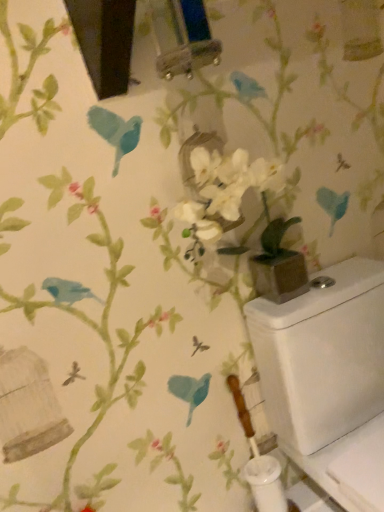
What is the approximate width of white glossy water tank at lower right?

It is 43.91 centimeters.

I want to click on white glossy water tank at lower right, so click(x=322, y=354).

Image resolution: width=384 pixels, height=512 pixels. What do you see at coordinates (322, 354) in the screenshot?
I see `white glossy water tank at lower right` at bounding box center [322, 354].

Image resolution: width=384 pixels, height=512 pixels. In order to click on white glossy water tank at lower right in this screenshot , I will do `click(322, 354)`.